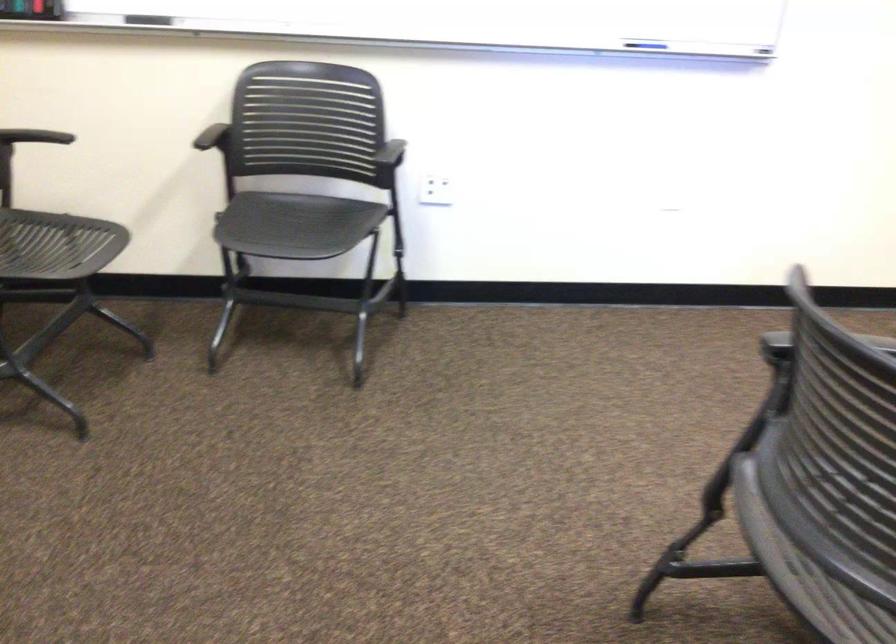
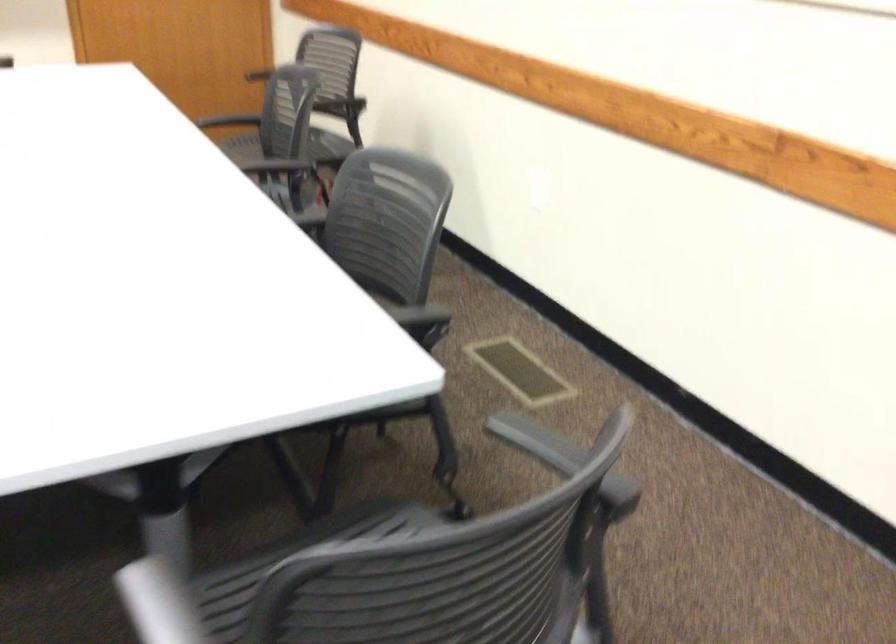
Based on the photo, first-person continuous shooting, in which direction is the camera rotating?

The rotation direction of the camera is right-down.